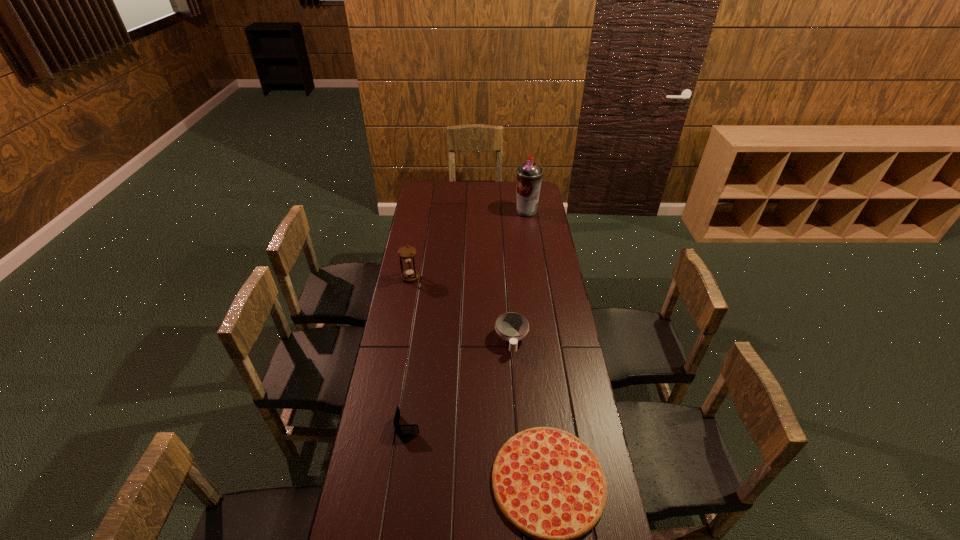
Where is `free space located 0.200m on the side with the handle of the chinaware`? free space located 0.200m on the side with the handle of the chinaware is located at coordinates (516, 399).

Image resolution: width=960 pixels, height=540 pixels. Find the location of `free space located 0.370m on the outer surface of the fourth object from right to left`. free space located 0.370m on the outer surface of the fourth object from right to left is located at coordinates (524, 424).

This screenshot has height=540, width=960. I want to click on hourglass present at the left edge, so click(x=408, y=253).

In order to click on wallet at the left edge in this screenshot , I will do (x=408, y=429).

The image size is (960, 540). In order to click on object that is at the right edge in this screenshot , I will do `click(529, 175)`.

The width and height of the screenshot is (960, 540). I want to click on free location at the left edge, so click(x=414, y=362).

You are a GUI agent. You are given a task and a screenshot of the screen. Output one action in this format:
    pyautogui.click(x=<x>, y=<y>)
    Task: Click on the vacant space at the right edge
    The image size is (960, 540).
    Given the screenshot: What is the action you would take?
    pyautogui.click(x=595, y=439)

The width and height of the screenshot is (960, 540). Identify the location of free spot at the far left corner of the desktop. (432, 191).

Where is `free spot between the hourglass and the farthest object`? This screenshot has height=540, width=960. free spot between the hourglass and the farthest object is located at coordinates (468, 245).

You are a GUI agent. You are given a task and a screenshot of the screen. Output one action in this format:
    pyautogui.click(x=<x>, y=<y>)
    Task: Click on the vacant area that lies between the wallet and the farthest object
    The image size is (960, 540).
    Given the screenshot: What is the action you would take?
    pyautogui.click(x=468, y=318)